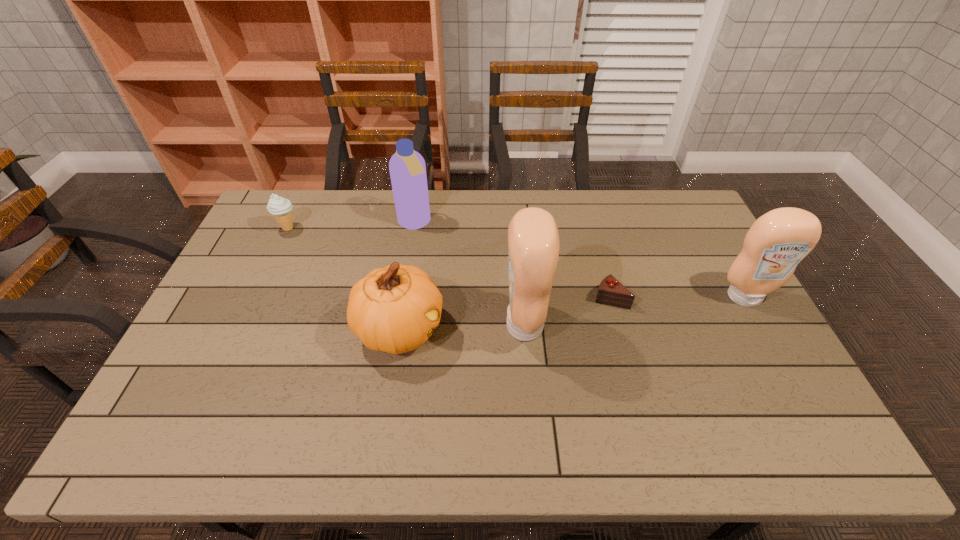
Identify the location of the taller condiment. (533, 239).

Find the location of a particular element. This screenshot has height=540, width=960. the fourth object from left to right is located at coordinates (533, 239).

At what (x,y) coordinates should I click in order to perform the action: click on the rightmost object. Please return your answer as a coordinate pair (x, y). Looking at the image, I should click on (779, 240).

This screenshot has width=960, height=540. I want to click on the shorter condiment, so click(x=779, y=240).

You are a GUI agent. You are given a task and a screenshot of the screen. Output one action in this format:
    pyautogui.click(x=<x>, y=<y>)
    Task: Click on the shampoo
    The image size is (960, 540).
    Given the screenshot: What is the action you would take?
    pyautogui.click(x=407, y=168)

You are a GUI agent. You are given a task and a screenshot of the screen. Output one action in this format:
    pyautogui.click(x=<x>, y=<y>)
    Task: Click on the pumpkin
    The width and height of the screenshot is (960, 540).
    Given the screenshot: What is the action you would take?
    pyautogui.click(x=394, y=309)

The width and height of the screenshot is (960, 540). I want to click on the second shortest object, so click(280, 207).

This screenshot has height=540, width=960. In order to click on the leftmost object in this screenshot , I will do `click(280, 207)`.

The width and height of the screenshot is (960, 540). Find the location of `the shortest object`. the shortest object is located at coordinates (611, 292).

Where is `the fifth object from left to right`? the fifth object from left to right is located at coordinates (611, 292).